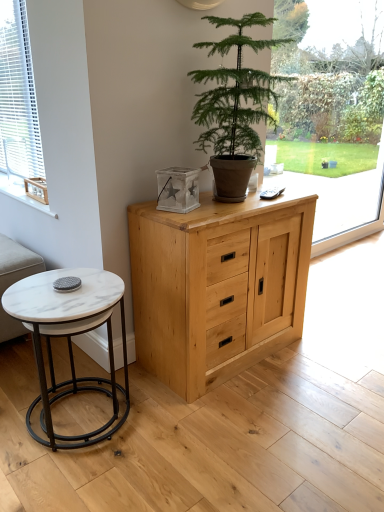
Where is `vacant space to the right of natural wood cabinet at center`? This screenshot has width=384, height=512. vacant space to the right of natural wood cabinet at center is located at coordinates (328, 360).